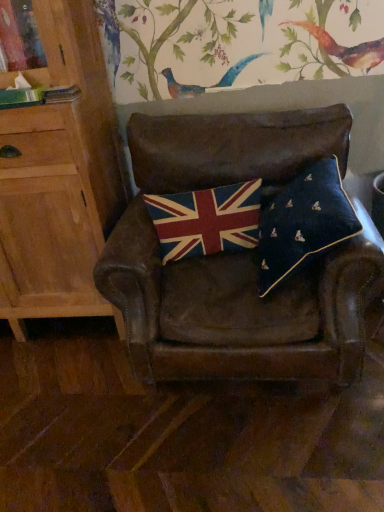
Question: Is textured woolen flag at center inside or outside of leather chair at center?

Choices:
 (A) outside
 (B) inside

Answer: (B)

Question: Would you say textured woolen flag at center is to the left or to the right of leather chair at center in the picture?

Choices:
 (A) left
 (B) right

Answer: (A)

Question: Which is nearer to the light wood cabinet at left?

Choices:
 (A) navy velvet pillow at center
 (B) textured woolen flag at center
 (C) leather chair at center

Answer: (C)

Question: Which is nearer to the leather chair at center?

Choices:
 (A) navy velvet pillow at center
 (B) light wood cabinet at left
 (C) textured woolen flag at center

Answer: (C)